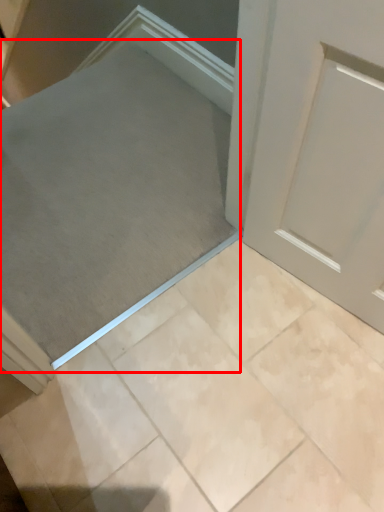
Question: From the image's perspective, where is ramp (annotated by the red box) located in relation to ceramic tile in the image?

Choices:
 (A) below
 (B) above

Answer: (B)